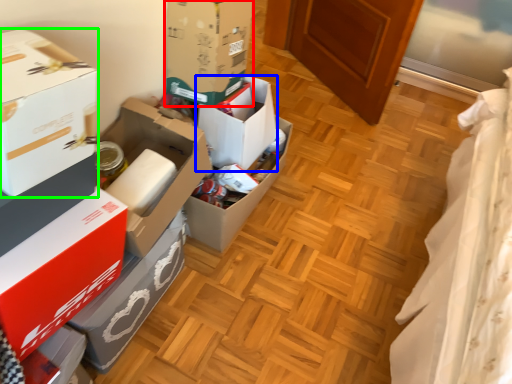
Question: Which is farther away from box (highlighted by a red box)? box (highlighted by a blue box) or box (highlighted by a green box)?

Choices:
 (A) box
 (B) box

Answer: (B)